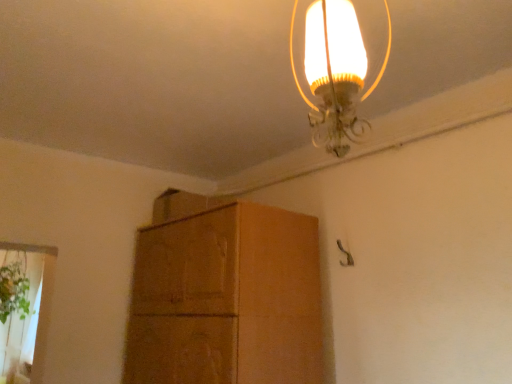
Question: From the image's perspective, is green leafy plant at lower left under brown cardboard cabinet at center?

Choices:
 (A) yes
 (B) no

Answer: (A)

Question: Considering the relative positions of green leafy plant at lower left and brown cardboard cabinet at center in the image provided, is green leafy plant at lower left to the right of brown cardboard cabinet at center from the viewer's perspective?

Choices:
 (A) no
 (B) yes

Answer: (A)

Question: Is brown cardboard cabinet at center surrounded by green leafy plant at lower left?

Choices:
 (A) yes
 (B) no

Answer: (B)

Question: Considering the relative sizes of green leafy plant at lower left and brown cardboard cabinet at center in the image provided, is green leafy plant at lower left bigger than brown cardboard cabinet at center?

Choices:
 (A) yes
 (B) no

Answer: (B)

Question: From a real-world perspective, is green leafy plant at lower left positioned under brown cardboard cabinet at center based on gravity?

Choices:
 (A) no
 (B) yes

Answer: (A)

Question: Is green leafy plant at lower left facing away from brown cardboard cabinet at center?

Choices:
 (A) yes
 (B) no

Answer: (B)

Question: Is brown cardboard cabinet at center inside translucent glass lampshade at upper center?

Choices:
 (A) no
 (B) yes

Answer: (A)

Question: Would you consider translucent glass lampshade at upper center to be distant from brown cardboard cabinet at center?

Choices:
 (A) no
 (B) yes

Answer: (B)

Question: Considering the relative sizes of translucent glass lampshade at upper center and brown cardboard cabinet at center in the image provided, is translucent glass lampshade at upper center bigger than brown cardboard cabinet at center?

Choices:
 (A) no
 (B) yes

Answer: (A)

Question: Is translucent glass lampshade at upper center completely or partially outside of brown cardboard cabinet at center?

Choices:
 (A) no
 (B) yes

Answer: (B)

Question: Does translucent glass lampshade at upper center appear on the left side of brown cardboard cabinet at center?

Choices:
 (A) no
 (B) yes

Answer: (A)

Question: Can you confirm if translucent glass lampshade at upper center is wider than brown cardboard cabinet at center?

Choices:
 (A) yes
 (B) no

Answer: (B)

Question: Could you tell me if green leafy plant at lower left is facing translucent glass lampshade at upper center?

Choices:
 (A) no
 (B) yes

Answer: (B)